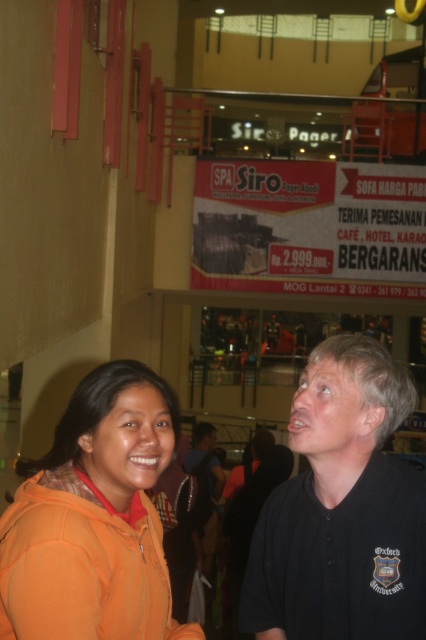
Between point (304, 538) and point (77, 547), which one is positioned in front?

Point (77, 547) is more forward.

Describe the element at coordinates (342, 509) in the screenshot. This screenshot has height=640, width=426. I see `orange fleece at center` at that location.

Locate an element on the screen. orange fleece at center is located at coordinates (342, 509).

Based on the photo, is black shirt at center wider than orange fleece at lower left?

No.

Can you confirm if black shirt at center is positioned above orange fleece at lower left?

No, black shirt at center is not above orange fleece at lower left.

Between point (408, 481) and point (52, 522), which one is positioned behind?

The point (408, 481) is behind.

Image resolution: width=426 pixels, height=640 pixels. Identify the location of black shirt at center. (342, 509).

In the scene shown: Does orange fleece at center come in front of black shirt at center?

No, orange fleece at center is further to the viewer.

Find the location of a particular element. orange fleece at center is located at coordinates [x=342, y=509].

What are the coordinates of `orange fleece at center` in the screenshot? It's located at (342, 509).